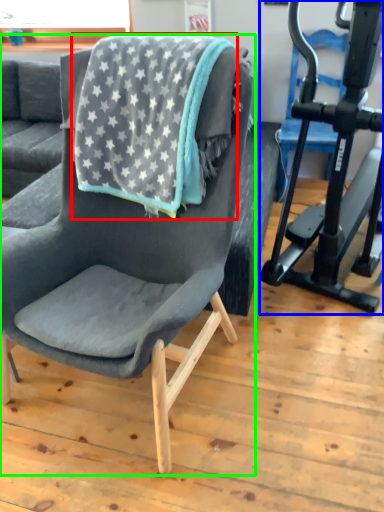
Question: Based on their relative distances, which object is nearer to beach towel (highlighted by a red box)? Choose from stationary bicycle (highlighted by a blue box) and chair (highlighted by a green box).

Choices:
 (A) stationary bicycle
 (B) chair

Answer: (B)